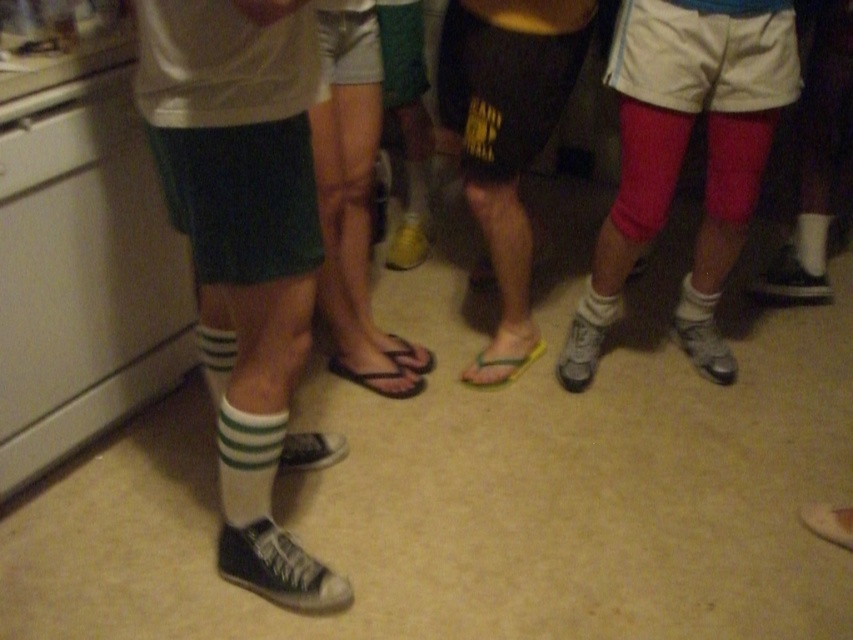
Does matte black sneaker at left appear on the left side of rubber flip-flop at center?

Indeed, matte black sneaker at left is positioned on the left side of rubber flip-flop at center.

Is matte black sneaker at left to the right of rubber flip-flop at center from the viewer's perspective?

In fact, matte black sneaker at left is to the left of rubber flip-flop at center.

Image resolution: width=853 pixels, height=640 pixels. Describe the element at coordinates (244, 250) in the screenshot. I see `matte black sneaker at left` at that location.

You are a GUI agent. You are given a task and a screenshot of the screen. Output one action in this format:
    pyautogui.click(x=<x>, y=<y>)
    Task: Click on the matte black sneaker at left
    The height and width of the screenshot is (640, 853).
    Given the screenshot: What is the action you would take?
    pyautogui.click(x=244, y=250)